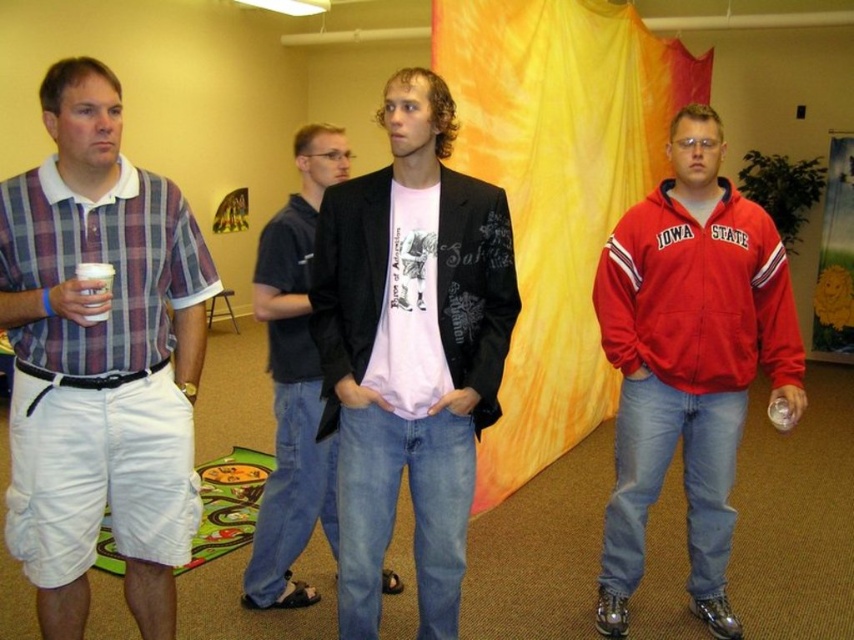
You are at the coordinates of point (484, 336) and want to move towards the exit located at point (703, 276). Is there any obstruction between your current position and the exit?

Point (484, 336) is in front of point (703, 276), so there is no obstruction between your current position and the exit.